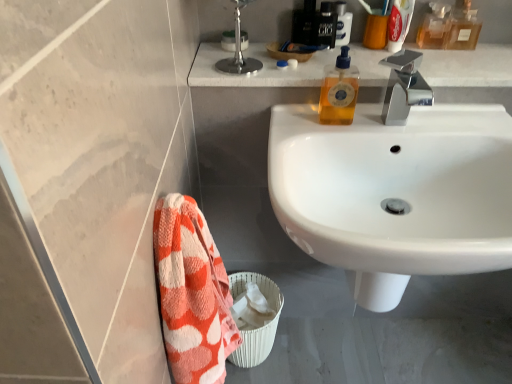
You are a GUI agent. You are given a task and a screenshot of the screen. Output one action in this format:
    pyautogui.click(x=<x>, y=<y>)
    Task: Click on the free space in front of transparent glass bottle at upper right, acting as the fourth mouthwash starting from the left
    
    Given the screenshot: What is the action you would take?
    pyautogui.click(x=467, y=61)